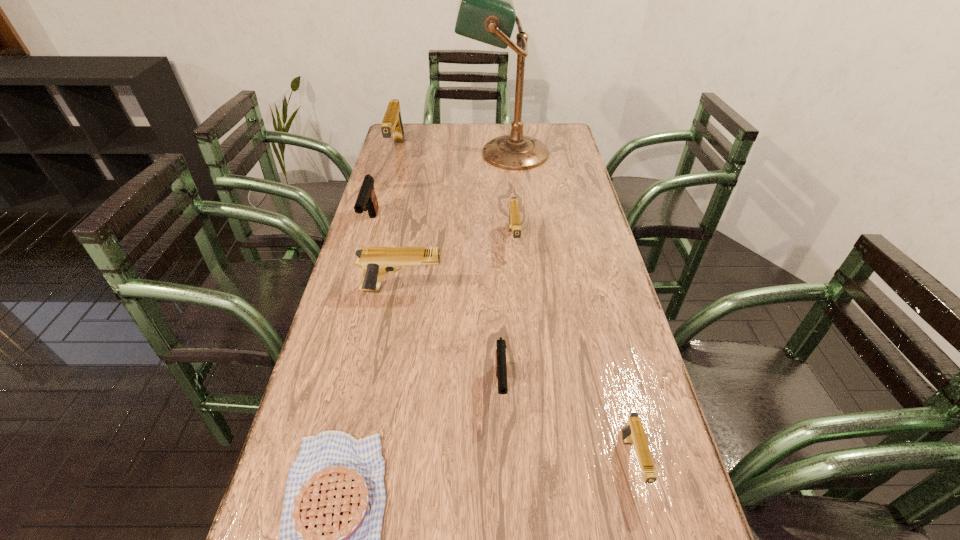
This screenshot has width=960, height=540. What are the coordinates of `vacant space at the left edge of the desktop` in the screenshot? It's located at (378, 191).

The height and width of the screenshot is (540, 960). In order to click on vacant position at the right edge of the desktop in this screenshot , I will do `click(607, 486)`.

The width and height of the screenshot is (960, 540). Identify the location of free region at the far right corner. (559, 144).

The width and height of the screenshot is (960, 540). What are the coordinates of `vacant area between the second smallest tan pistol and the shortest pistol` in the screenshot? It's located at (573, 352).

I want to click on vacant area between the nearer black pistol and the farther black pistol, so click(436, 306).

At what (x,y) coordinates should I click in order to perform the action: click on vacant space that is in between the biggest tan pistol and the tallest object. Please return your answer as a coordinate pair (x, y). The width and height of the screenshot is (960, 540). Looking at the image, I should click on (450, 152).

I want to click on free space between the rightmost object and the nearer black pistol, so click(x=566, y=424).

This screenshot has width=960, height=540. In order to click on free spot between the farthest pistol and the third tan pistol from left to right in this screenshot , I will do `click(455, 196)`.

This screenshot has height=540, width=960. What are the coordinates of `free space between the tallest object and the right black pistol` in the screenshot? It's located at (503, 271).

Locate an element on the screen. The height and width of the screenshot is (540, 960). unoccupied area between the farther black pistol and the second tan pistol from right to left is located at coordinates (443, 233).